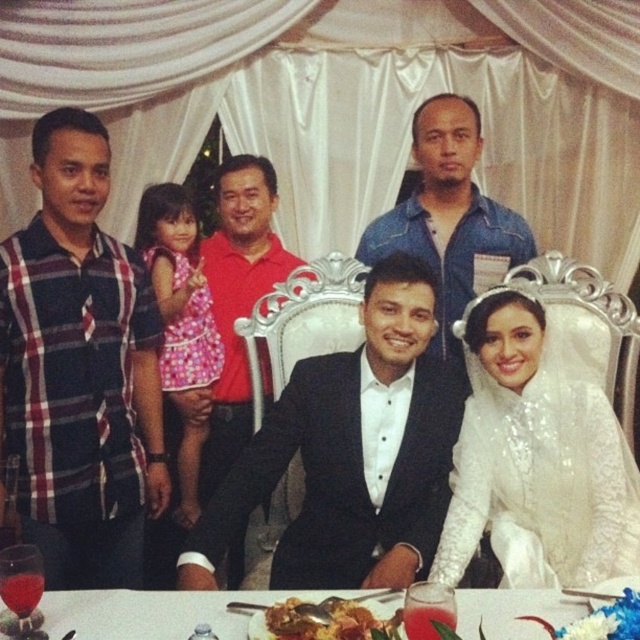
Question: Does denim shirt at center appear over red smooth shirt at center?

Choices:
 (A) no
 (B) yes

Answer: (B)

Question: Which object appears closest to the camera in this image?

Choices:
 (A) plaid fabric shirt at left
 (B) denim shirt at center
 (C) black satin suit at center
 (D) white satin dress at center

Answer: (C)

Question: Among these objects, which one is nearest to the camera?

Choices:
 (A) translucent glass water at lower center
 (B) white satin dress at center

Answer: (A)

Question: Does black satin suit at center have a larger size compared to golden brown rice at center?

Choices:
 (A) yes
 (B) no

Answer: (A)

Question: Among these points, which one is nearest to the camera?

Choices:
 (A) (49, 627)
 (B) (104, 166)
 (C) (188, 445)
 (D) (445, 218)

Answer: (A)

Question: Can you confirm if plaid fabric shirt at left is wider than white sequined dress at center?

Choices:
 (A) yes
 (B) no

Answer: (B)